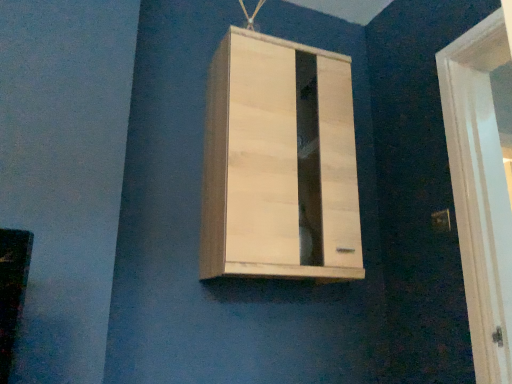
Measure the distance between natural wood cabinet at center and camera.

4.25 feet.

This screenshot has width=512, height=384. Describe the element at coordinates (279, 163) in the screenshot. I see `natural wood cabinet at center` at that location.

In order to click on natural wood cabinet at center in this screenshot , I will do `click(279, 163)`.

You are a GUI agent. You are given a task and a screenshot of the screen. Output one action in this format:
    pyautogui.click(x=<x>, y=<y>)
    Task: Click on the natural wood cabinet at center
    
    Given the screenshot: What is the action you would take?
    pyautogui.click(x=279, y=163)